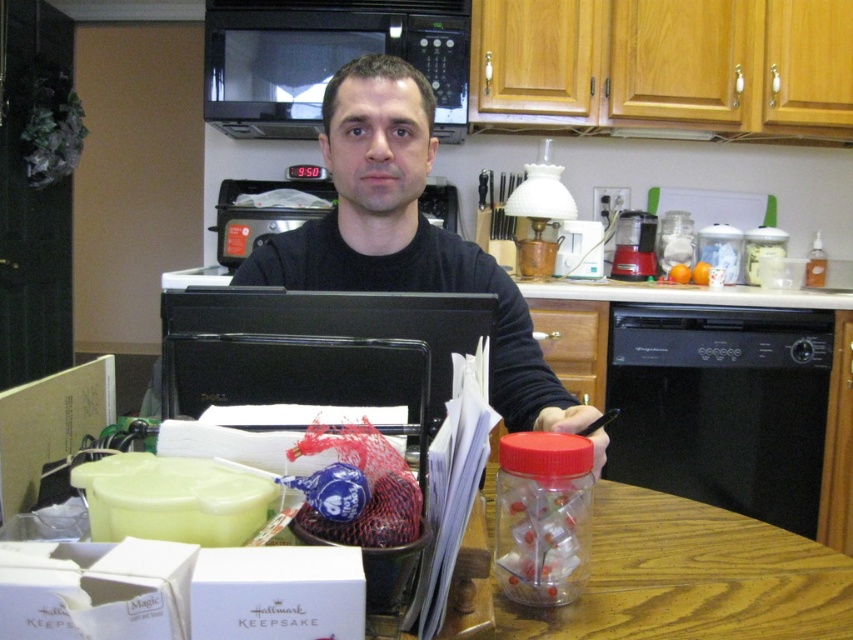
You are a delivery person who needs to place a small package on the counter between the black matte shirt at center and the black matte microwave at upper center. Can you fit it there?

The black matte shirt at center is taller than the black matte microwave at upper center, so there is sufficient vertical space between them to place the small package.

You are a delivery person who needs to place a small package on the counter between the black matte shirt at center and the black matte microwave at upper center. Can you fit it there?

The black matte shirt at center is closer to the viewer than the black matte microwave at upper center, so there is space between them for the package.

What is located at the coordinates point (405, 234) in the kitchen scene?

The black matte shirt at center is located at point (405, 234).